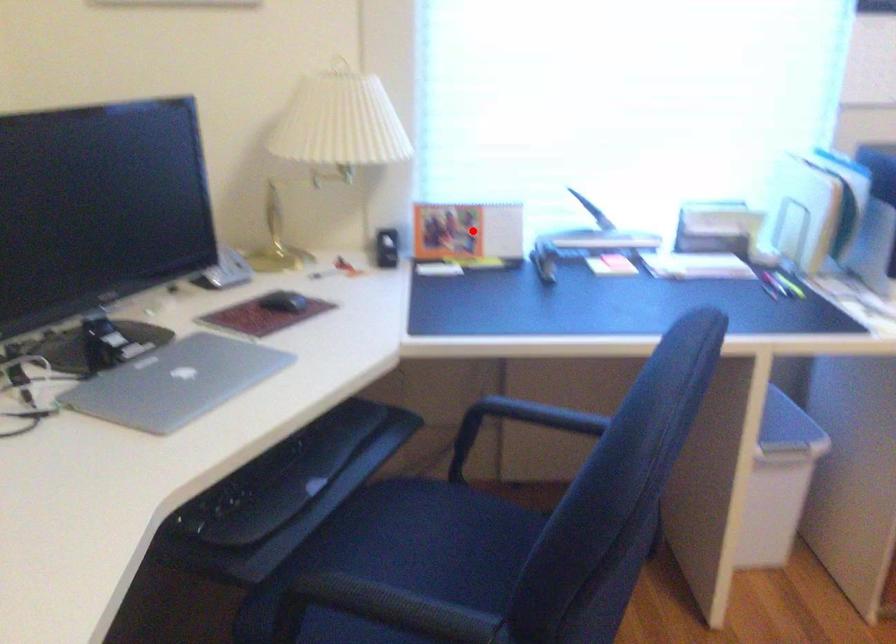
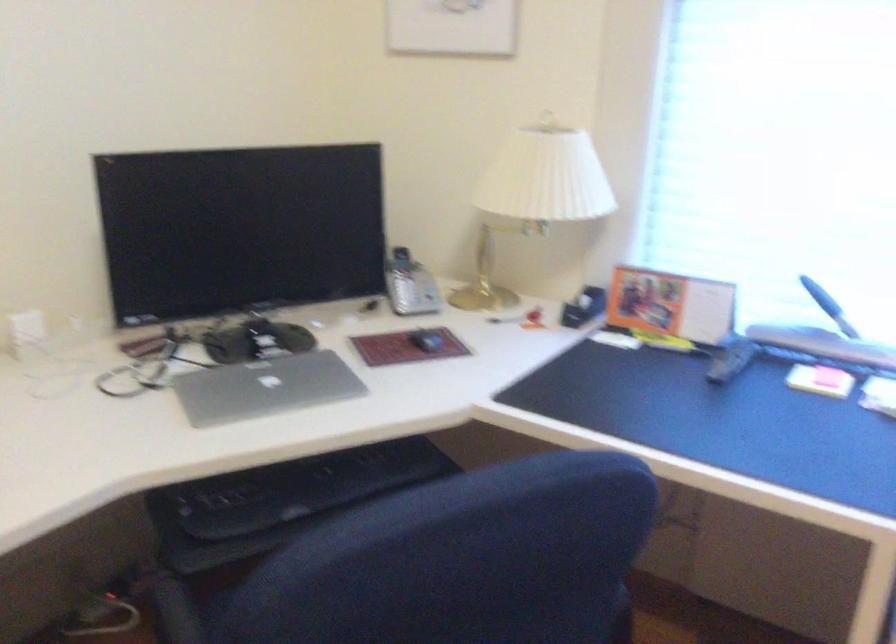
In the second image, find the point that corresponds to the highlighted location in the first image.

(670, 305)